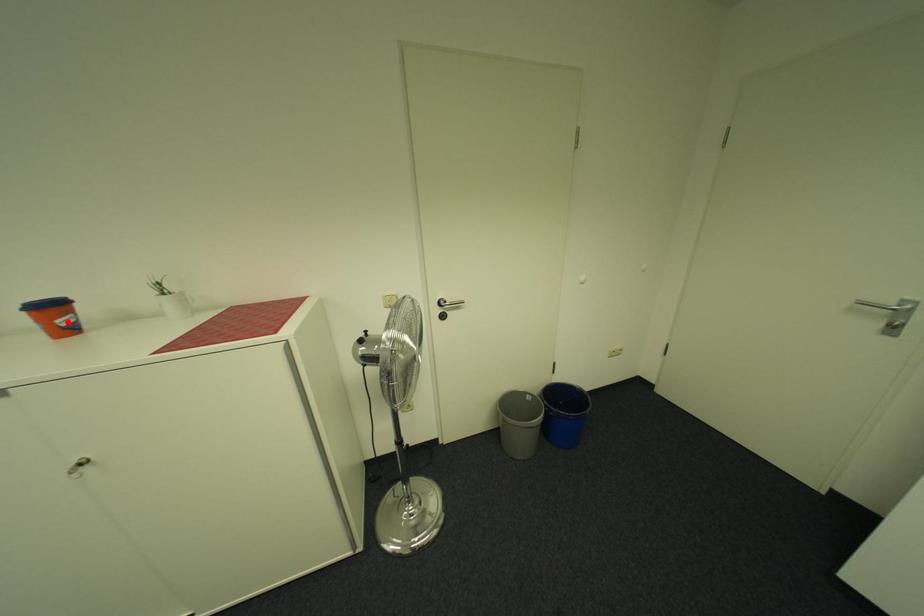
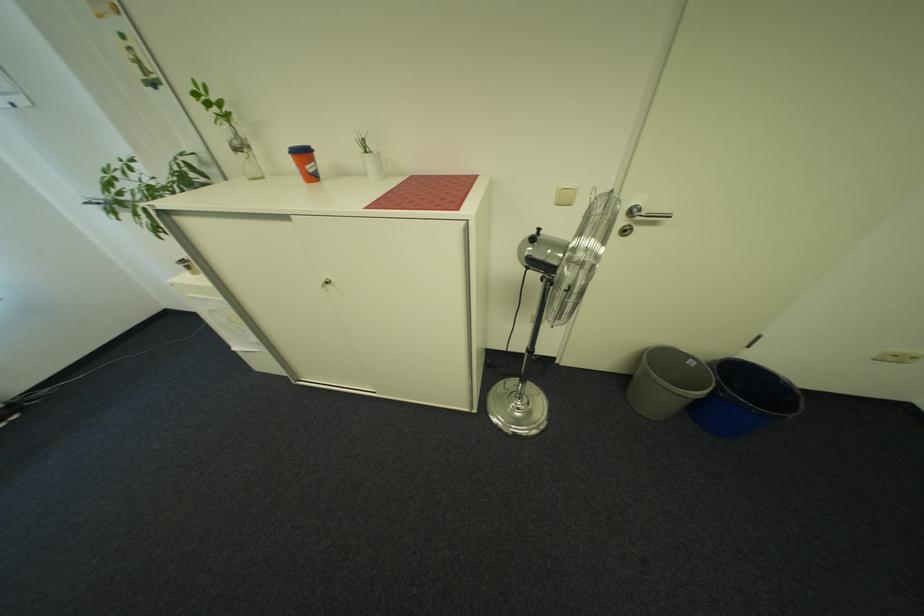
In the second image, find the point that corresponds to the highlighted location in the first image.

(317, 168)